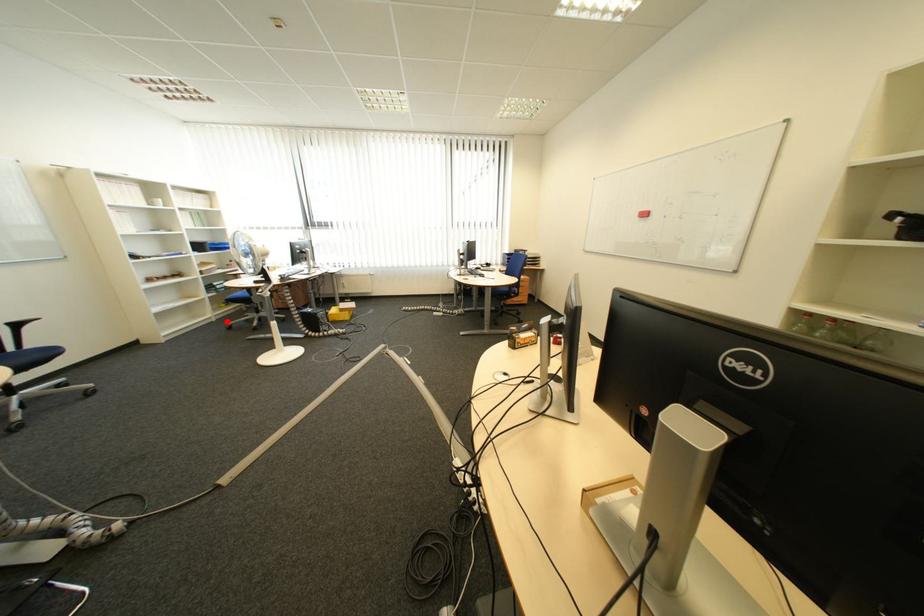
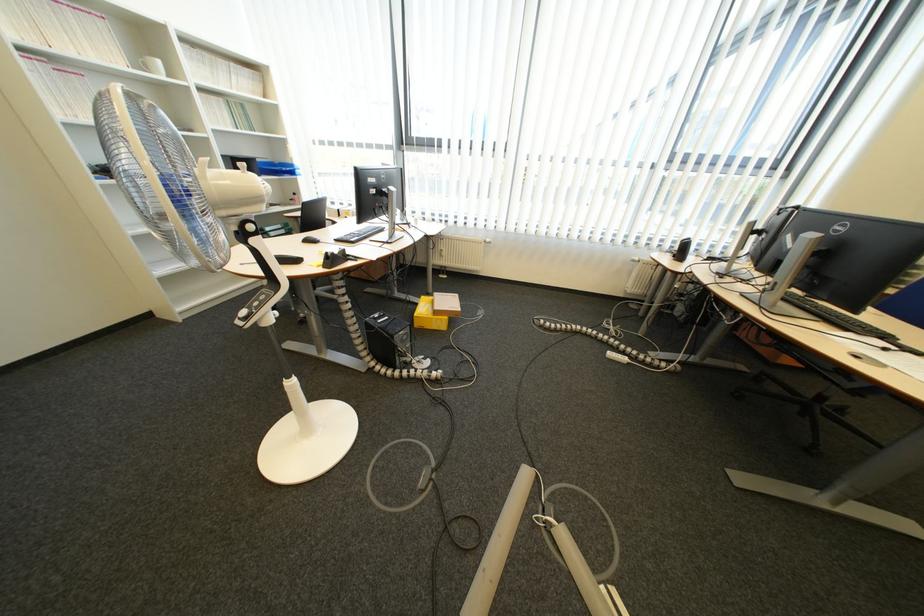
Question: I am providing you with two images of the same scene from different viewpoints. A red point is shown in image1. For the corresponding object point in image2, is it positioned nearer or farther from the camera?

Choices:
 (A) Nearer
 (B) Farther

Answer: (B)